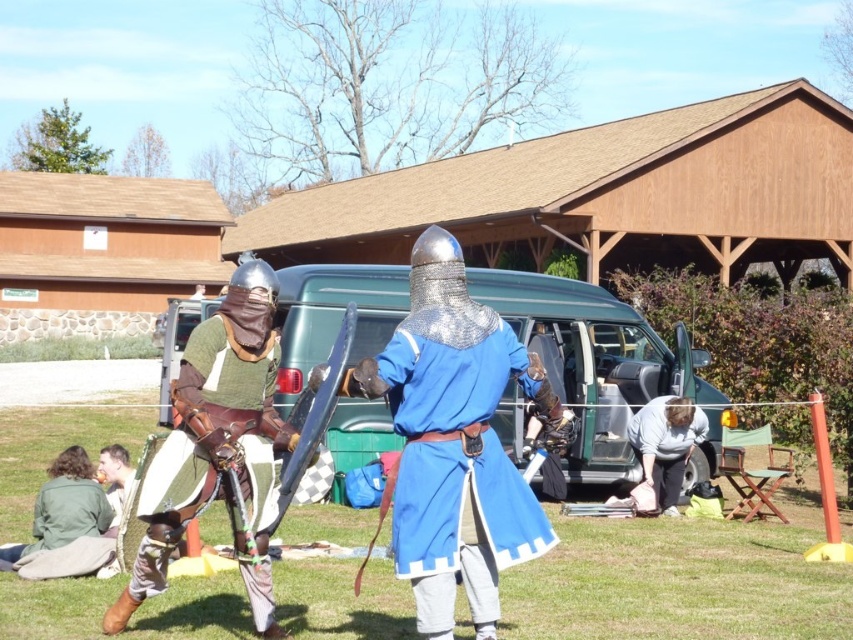
Identify the location of gray fabric bag at lower right. (666, 444).

Does metallic chainmail armor at center have a lesser height compared to green fabric jacket at lower left?

In fact, metallic chainmail armor at center may be taller than green fabric jacket at lower left.

Between metallic chainmail armor at center and green fabric jacket at lower left, which one is positioned higher?

metallic chainmail armor at center is higher up.

Does point (444, 241) lie behind point (71, 532)?

That is False.

This screenshot has height=640, width=853. Find the location of `metallic chainmail armor at center`. metallic chainmail armor at center is located at coordinates (454, 442).

Does green leather armor at center appear on the left side of green fabric jacket at lower left?

Incorrect, green leather armor at center is not on the left side of green fabric jacket at lower left.

Identify the location of green leather armor at center. (216, 454).

Find the location of a particular element. The image size is (853, 640). green leather armor at center is located at coordinates (216, 454).